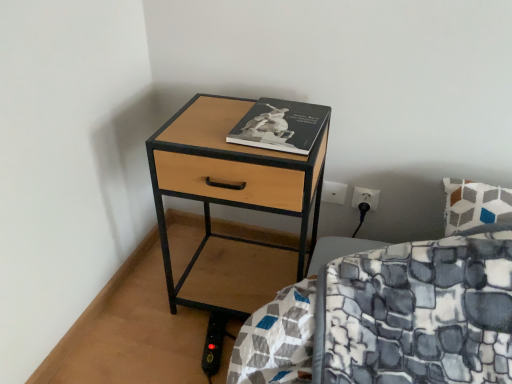
Image resolution: width=512 pixels, height=384 pixels. I want to click on empty space that is ontop of black matte book at center, so click(280, 116).